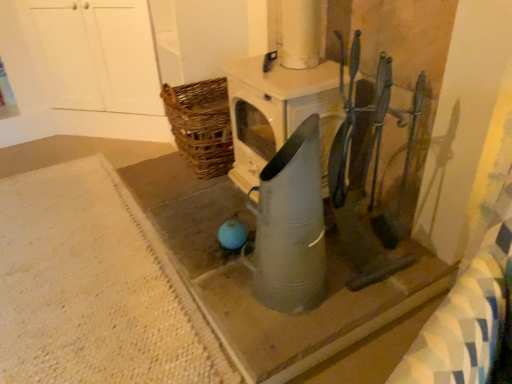
Where is `free space in front of metallic gray watering can at center`? Image resolution: width=512 pixels, height=384 pixels. free space in front of metallic gray watering can at center is located at coordinates (281, 336).